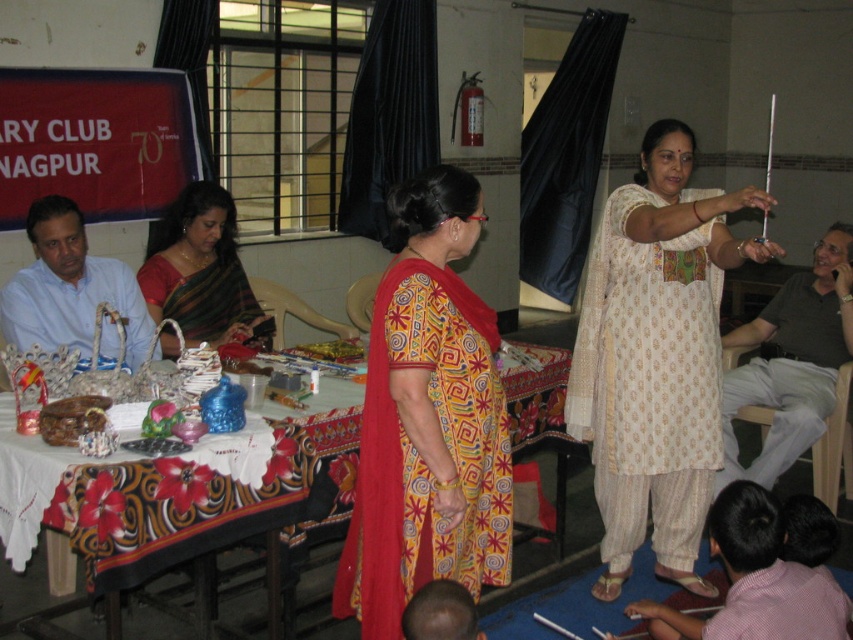
Is white printed kurta at center wider than yellow printed dress at center?

Yes, white printed kurta at center is wider than yellow printed dress at center.

Is white printed kurta at center closer to camera compared to yellow printed dress at center?

No, white printed kurta at center is behind yellow printed dress at center.

Where is `white printed kurta at center`? white printed kurta at center is located at coordinates (656, 356).

Which is above, yellow printed dress at center or patterned fabric table at center?

yellow printed dress at center is higher up.

This screenshot has width=853, height=640. What do you see at coordinates (427, 419) in the screenshot?
I see `yellow printed dress at center` at bounding box center [427, 419].

Locate an element on the screen. This screenshot has height=640, width=853. yellow printed dress at center is located at coordinates (427, 419).

Between patterned fabric table at center and pink cotton shirt at lower right, which one is positioned lower?

pink cotton shirt at lower right is lower down.

Can you confirm if patterned fabric table at center is wider than pink cotton shirt at lower right?

Yes, patterned fabric table at center is wider than pink cotton shirt at lower right.

What do you see at coordinates (209, 506) in the screenshot? I see `patterned fabric table at center` at bounding box center [209, 506].

This screenshot has width=853, height=640. What are the coordinates of `patterned fabric table at center` in the screenshot? It's located at (209, 506).